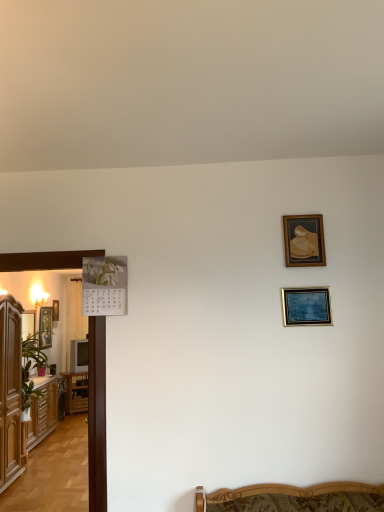
Question: From the image's perspective, is brown wooden table at left beneath gold-framed picture at left, placed as the first picture frame when sorted from back to front?

Choices:
 (A) no
 (B) yes

Answer: (B)

Question: Can you confirm if brown wooden table at left is shorter than gold-framed picture at left, placed as the first picture frame when sorted from back to front?

Choices:
 (A) no
 (B) yes

Answer: (A)

Question: Considering the relative sizes of brown wooden table at left and gold-framed picture at left, which is the 1th picture frame in left-to-right order, in the image provided, is brown wooden table at left bigger than gold-framed picture at left, which is the 1th picture frame in left-to-right order,?

Choices:
 (A) yes
 (B) no

Answer: (A)

Question: Can you confirm if brown wooden table at left is wider than gold-framed picture at left, marked as the fifth picture frame in a right-to-left arrangement?

Choices:
 (A) yes
 (B) no

Answer: (A)

Question: Does brown wooden table at left appear on the right side of gold-framed picture at left, arranged as the 5th picture frame when viewed from the front?

Choices:
 (A) yes
 (B) no

Answer: (A)

Question: Considering the relative sizes of brown wooden table at left and gold-framed picture at left, marked as the fifth picture frame in a right-to-left arrangement, in the image provided, is brown wooden table at left thinner than gold-framed picture at left, marked as the fifth picture frame in a right-to-left arrangement,?

Choices:
 (A) no
 (B) yes

Answer: (A)

Question: Does gold-framed portrait at left, placed as the fourth picture frame when sorted from front to back, have a smaller size compared to metallic silver picture frame at center right, which is counted as the 5th picture frame, starting from the back?

Choices:
 (A) no
 (B) yes

Answer: (A)

Question: Could metallic silver picture frame at center right, marked as the first picture frame in a front-to-back arrangement, be considered to be inside gold-framed portrait at left, the 2th picture frame positioned from the back?

Choices:
 (A) yes
 (B) no

Answer: (B)

Question: From the image's perspective, is gold-framed portrait at left, the 2th picture frame positioned from the back, on top of metallic silver picture frame at center right, marked as the first picture frame in a front-to-back arrangement?

Choices:
 (A) yes
 (B) no

Answer: (B)

Question: From a real-world perspective, is gold-framed portrait at left, acting as the third picture frame starting from the left, physically below metallic silver picture frame at center right, marked as the 4th picture frame in a left-to-right arrangement?

Choices:
 (A) yes
 (B) no

Answer: (A)

Question: Does gold-framed portrait at left, acting as the third picture frame starting from the left, have a lesser width compared to metallic silver picture frame at center right, marked as the 4th picture frame in a left-to-right arrangement?

Choices:
 (A) no
 (B) yes

Answer: (A)

Question: Can you confirm if gold-framed portrait at left, the 2th picture frame positioned from the back, is positioned to the right of metallic silver picture frame at center right, which is counted as the 5th picture frame, starting from the back?

Choices:
 (A) yes
 (B) no

Answer: (B)

Question: Is gold-framed picture at left, placed as the first picture frame when sorted from back to front, outside of gold-framed portrait at left, acting as the third picture frame starting from the left?

Choices:
 (A) yes
 (B) no

Answer: (A)